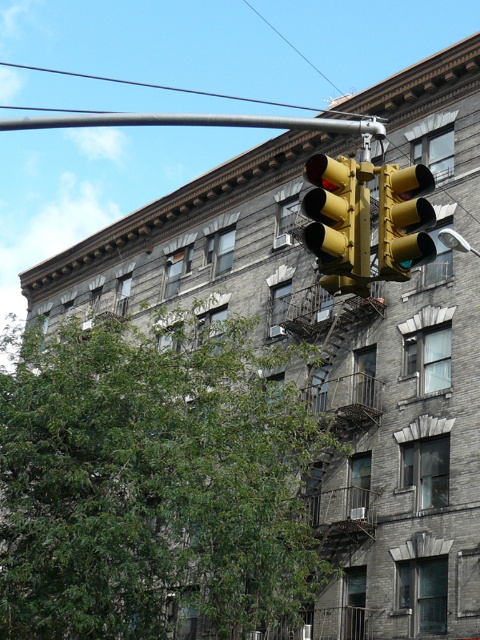
Does point (403, 180) come closer to viewer compared to point (441, 230)?

Yes.

The width and height of the screenshot is (480, 640). Identify the location of yellow matte traffic light at center. (404, 220).

Identify the location of yellow matte traffic light at center. (404, 220).

Who is more forward, [368,253] or [60,120]?

Point [368,253] is in front.

Locate an element on the screen. This screenshot has height=640, width=480. yellow matte traffic light at upper center is located at coordinates (338, 221).

Between point (327, 166) and point (153, 122), which one is positioned in front?

Point (327, 166)

I want to click on yellow matte traffic light at upper center, so click(x=338, y=221).

Is point (354, 257) behind point (454, 234)?

No, it is not.

Between yellow matte traffic light at upper center and yellow metallic street light at upper center, which one has more height?

Standing taller between the two is yellow matte traffic light at upper center.

Identify the location of yellow matte traffic light at upper center. 338,221.

Locate an element on the screen. yellow matte traffic light at upper center is located at coordinates (338, 221).